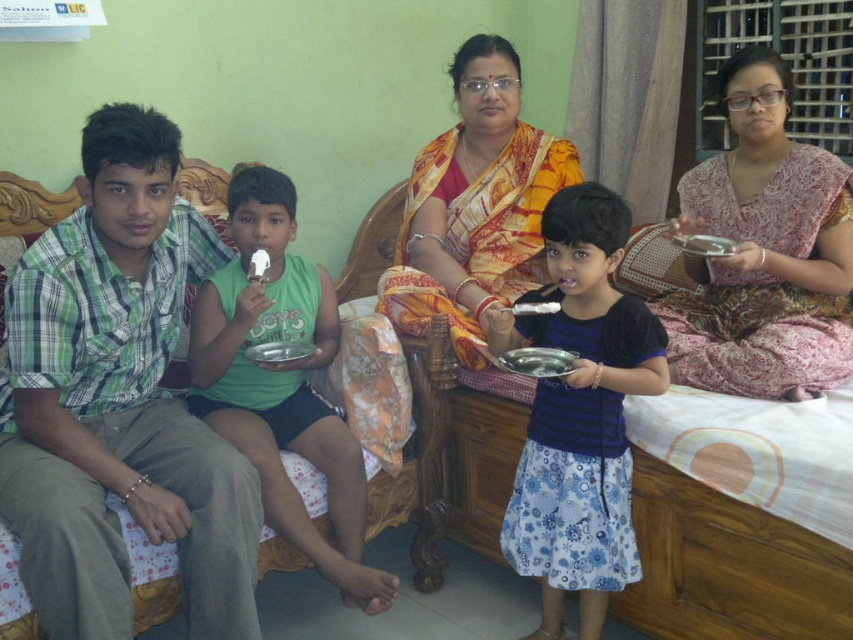
Question: Is green plaid shirt at left wider than pink floral saree at upper right?

Choices:
 (A) no
 (B) yes

Answer: (B)

Question: Estimate the real-world distances between objects in this image. Which object is farther from the metallic silver tray at center?

Choices:
 (A) green matte shirt at center
 (B) pink floral saree at upper right
 (C) green plaid shirt at left

Answer: (C)

Question: Is blue floral dress at center below yellow-orange sari at center?

Choices:
 (A) yes
 (B) no

Answer: (A)

Question: Which object is the closest to the green matte shirt at center?

Choices:
 (A) silver metallic tray at center
 (B) metallic silver tray at center
 (C) blue floral dress at center

Answer: (A)

Question: Estimate the real-world distances between objects in this image. Which object is farther from the blue floral dress at center?

Choices:
 (A) pink floral saree at upper right
 (B) green plaid shirt at left

Answer: (B)

Question: Can you confirm if pink floral saree at upper right is positioned below green matte shirt at center?

Choices:
 (A) no
 (B) yes

Answer: (A)